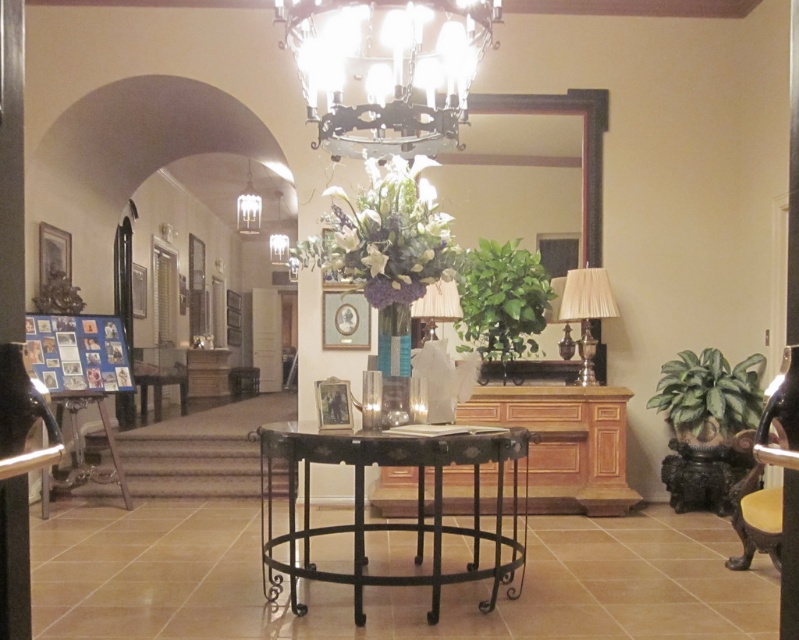
Question: Does green glossy leafy plant at right appear on the right side of white matte vase at center?

Choices:
 (A) yes
 (B) no

Answer: (A)

Question: Which point appears closest to the camera in this image?

Choices:
 (A) (706, 426)
 (B) (256, 220)

Answer: (A)

Question: Does metallic chandelier at upper center appear over clear glass chandelier at upper center?

Choices:
 (A) yes
 (B) no

Answer: (B)

Question: Where is black wrought iron table at center located in relation to white matte vase at center in the image?

Choices:
 (A) below
 (B) above

Answer: (A)

Question: Which object is positioned farthest from the white glossy vase at center?

Choices:
 (A) translucent glass vase at center
 (B) white matte vase at center
 (C) green leafy plant at center

Answer: (C)

Question: Which point is closer to the camera?

Choices:
 (A) (456, 451)
 (B) (505, 300)
 (C) (778, 403)
 (D) (281, 252)

Answer: (C)